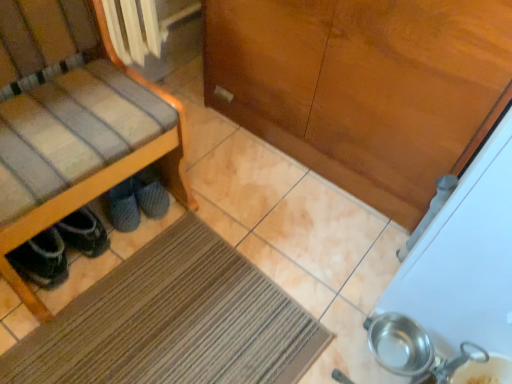
Identify the location of vacant space that's between wooden cabinet at center and brown textured mat at lower center. (260, 221).